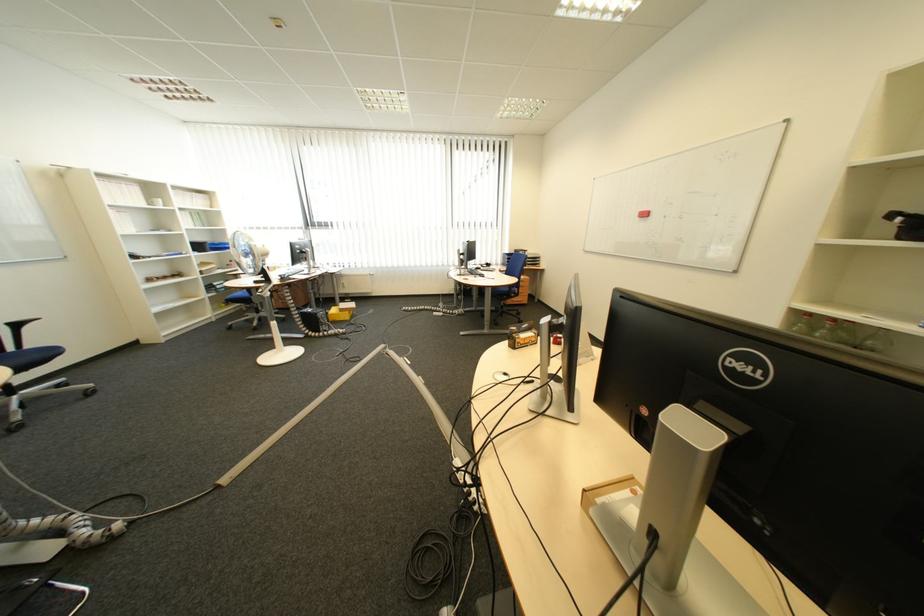
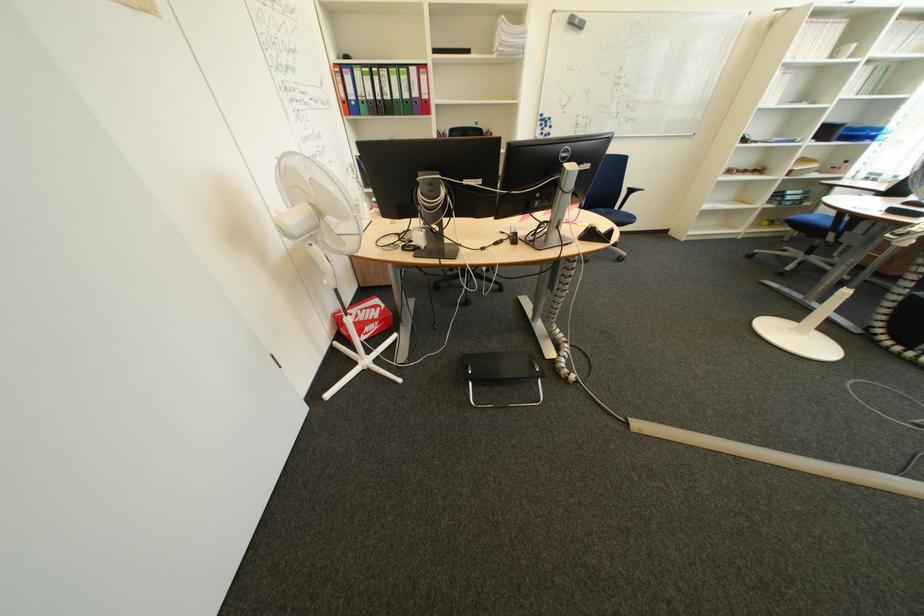
The point at (x=213, y=248) is marked in the first image. Where is the corresponding point in the second image?

(840, 132)